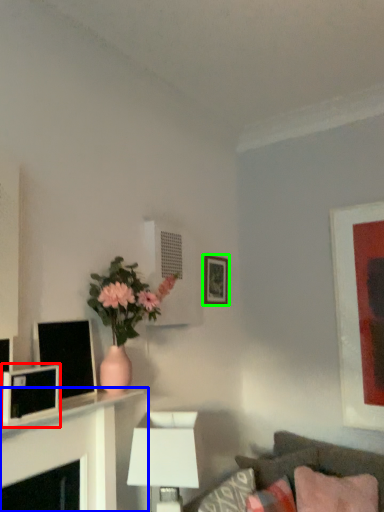
Question: Considering the real-world distances, which object is closest to computer monitor (highlighted by a red box)? table (highlighted by a blue box) or picture frame (highlighted by a green box).

Choices:
 (A) table
 (B) picture frame

Answer: (A)